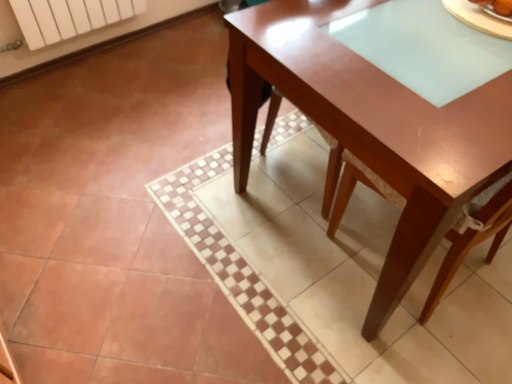
Question: In the image, is smooth brown bread at upper right positioned in front of or behind white matte radiator at upper left?

Choices:
 (A) front
 (B) behind

Answer: (A)

Question: From a real-world perspective, is smooth brown bread at upper right above or below white matte radiator at upper left?

Choices:
 (A) below
 (B) above

Answer: (B)

Question: Which is nearer to the glossy wood table at center?

Choices:
 (A) white matte radiator at upper left
 (B) smooth brown bread at upper right

Answer: (B)

Question: Which object is the closest to the white matte radiator at upper left?

Choices:
 (A) glossy wood table at center
 (B) smooth brown bread at upper right

Answer: (A)